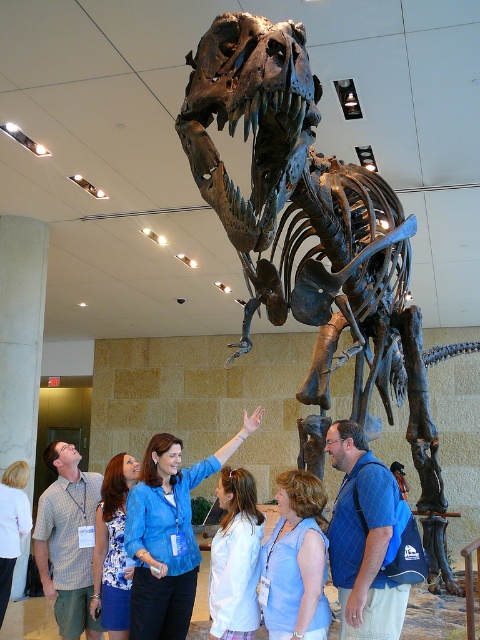
Can you confirm if shiny metallic skeleton at center is positioned to the left of blue fabric dress at lower left?

Incorrect, shiny metallic skeleton at center is not on the left side of blue fabric dress at lower left.

Which of these two, shiny metallic skeleton at center or blue fabric dress at lower left, stands shorter?

With less height is blue fabric dress at lower left.

You are a GUI agent. You are given a task and a screenshot of the screen. Output one action in this format:
    pyautogui.click(x=<x>, y=<y>)
    Task: Click on the shiny metallic skeleton at center
    This screenshot has width=480, height=640.
    Given the screenshot: What is the action you would take?
    pyautogui.click(x=315, y=243)

Identify the location of shiny metallic skeleton at center. (315, 243).

Can you confirm if blue shirt at center is positioned to the left of white cotton shirt at center?

Correct, you'll find blue shirt at center to the left of white cotton shirt at center.

In the scene shown: Does blue shirt at center appear under white cotton shirt at center?

Actually, blue shirt at center is above white cotton shirt at center.

Does point (168, 602) come farther from viewer compared to point (255, 608)?

Yes, point (168, 602) is farther from viewer.

Image resolution: width=480 pixels, height=640 pixels. Identify the location of blue shirt at center. (168, 534).

Is shiny metallic skeleton at center bigger than blue shirt at upper center?

Yes, shiny metallic skeleton at center is bigger than blue shirt at upper center.

Between point (383, 289) and point (64, 512), which one is positioned in front?

Point (383, 289) is in front.

Measure the distance between shiny metallic skeleton at center and camera.

A distance of 2.04 meters exists between shiny metallic skeleton at center and camera.

Where is `shiny metallic skeleton at center`? Image resolution: width=480 pixels, height=640 pixels. shiny metallic skeleton at center is located at coordinates (315, 243).